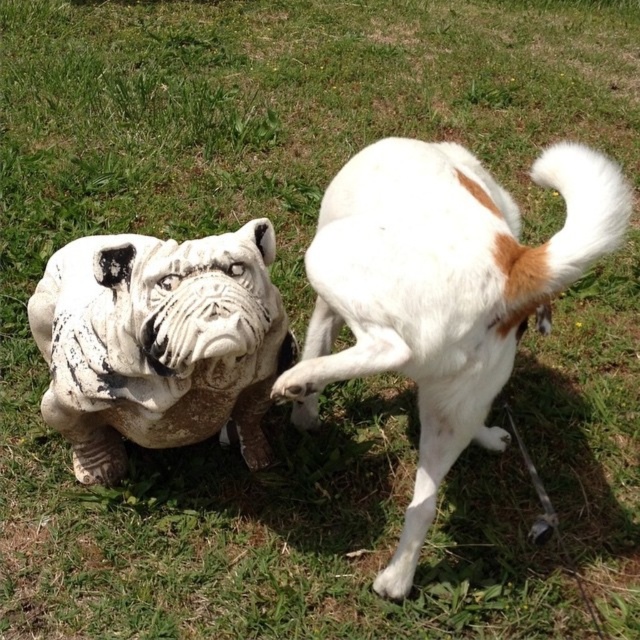
Question: Which point appears farthest from the camera in this image?

Choices:
 (A) click(243, 316)
 (B) click(346, 211)

Answer: (B)

Question: Which point appears closest to the camera in this image?

Choices:
 (A) (129, 296)
 (B) (515, 333)

Answer: (A)

Question: Is white fur dog at right positioned behind white stone statue at center?

Choices:
 (A) yes
 (B) no

Answer: (B)

Question: Does white fur dog at right appear on the left side of white stone statue at center?

Choices:
 (A) yes
 (B) no

Answer: (B)

Question: Which of the following is the closest to the observer?

Choices:
 (A) (342, 262)
 (B) (65, 284)

Answer: (A)

Question: Is white fur dog at right closer to the viewer compared to white stone statue at center?

Choices:
 (A) yes
 (B) no

Answer: (A)